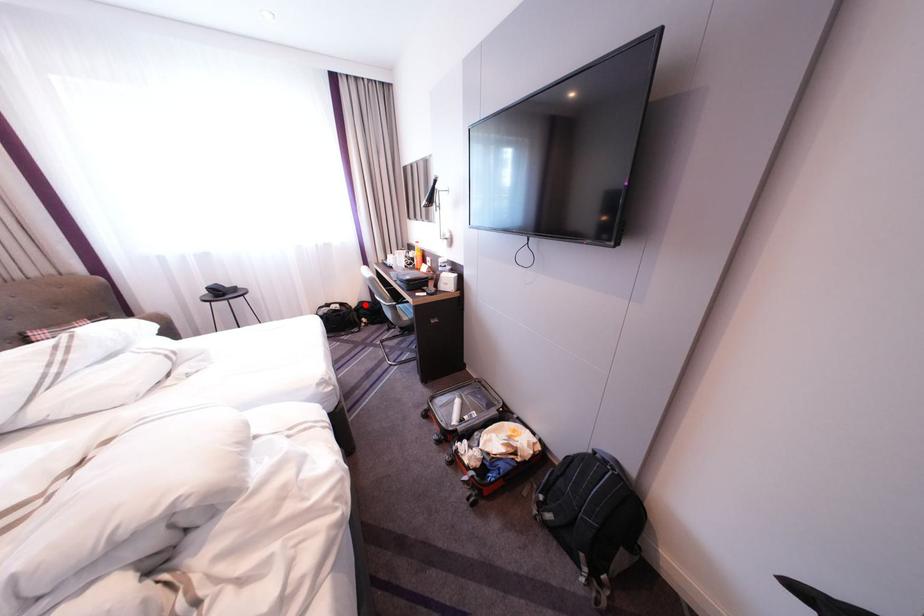
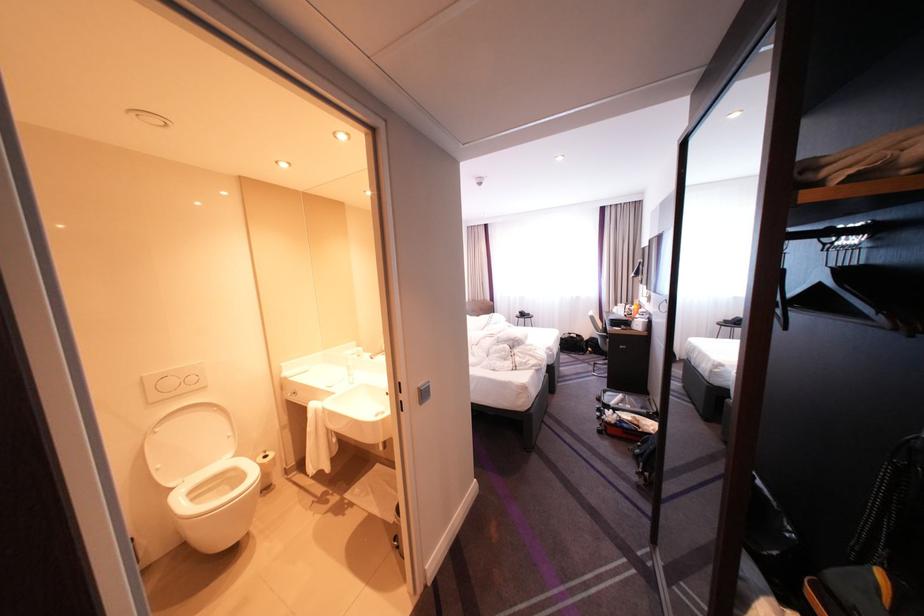
Find the pixel in the second image that matches the highlighted location in the first image.

(599, 338)